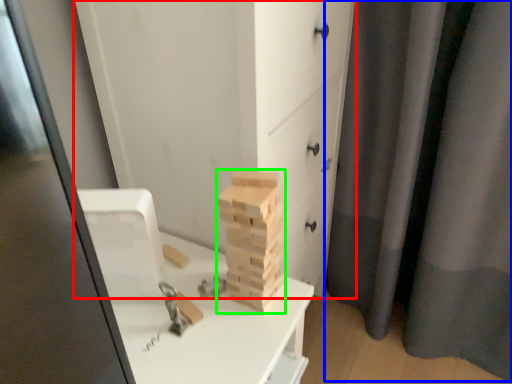
Question: Which object is the farthest from chest of drawers (highlighted by a red box)? Choose among these: curtain (highlighted by a blue box) or drawer (highlighted by a green box).

Choices:
 (A) curtain
 (B) drawer

Answer: (A)